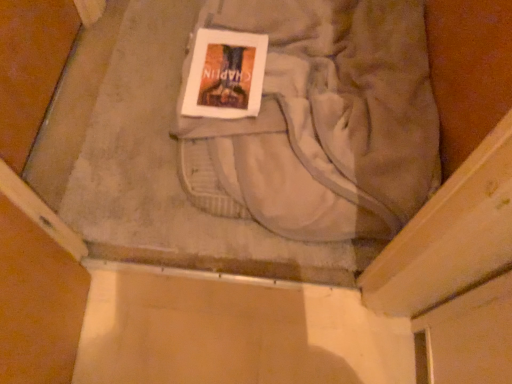
Image resolution: width=512 pixels, height=384 pixels. What do you see at coordinates (322, 122) in the screenshot?
I see `light gray cotton sweat pants at center` at bounding box center [322, 122].

The height and width of the screenshot is (384, 512). Find the location of `light gray cotton sweat pants at center`. light gray cotton sweat pants at center is located at coordinates (322, 122).

Measure the distance between point (361, 137) and camera.

1.15 meters.

Describe the element at coordinates (225, 74) in the screenshot. I see `hardcover book at center` at that location.

I want to click on hardcover book at center, so click(x=225, y=74).

What is the approximate height of hardcover book at center?

It is 1.00 centimeters.

Find the location of a particular element. The height and width of the screenshot is (384, 512). light gray cotton sweat pants at center is located at coordinates (322, 122).

Which is more to the right, hardcover book at center or light gray cotton sweat pants at center?

From the viewer's perspective, light gray cotton sweat pants at center appears more on the right side.

Is the depth of hardcover book at center less than that of light gray cotton sweat pants at center?

No.

Is point (234, 42) closer or farther from the camera than point (386, 223)?

Point (234, 42) appears to be farther away from the viewer than point (386, 223).

From the image's perspective, which is above, hardcover book at center or light gray cotton sweat pants at center?

light gray cotton sweat pants at center is shown above in the image.

From a real-world perspective, between hardcover book at center and light gray cotton sweat pants at center, who is vertically lower?

light gray cotton sweat pants at center.

Is hardcover book at center thinner than light gray cotton sweat pants at center?

Yes, hardcover book at center is thinner than light gray cotton sweat pants at center.

Considering the relative sizes of hardcover book at center and light gray cotton sweat pants at center in the image provided, is hardcover book at center taller than light gray cotton sweat pants at center?

No, hardcover book at center is not taller than light gray cotton sweat pants at center.

Considering the relative sizes of hardcover book at center and light gray cotton sweat pants at center in the image provided, is hardcover book at center smaller than light gray cotton sweat pants at center?

Yes.

Is hardcover book at center inside the boundaries of light gray cotton sweat pants at center, or outside?

hardcover book at center can be found inside light gray cotton sweat pants at center.

Is there a large distance between hardcover book at center and light gray cotton sweat pants at center?

They are positioned close to each other.

Could you tell me if hardcover book at center is facing light gray cotton sweat pants at center?

Yes, hardcover book at center faces towards light gray cotton sweat pants at center.

What's the angular difference between hardcover book at center and light gray cotton sweat pants at center's facing directions?

They differ by 0.415 degrees in their facing directions.

The image size is (512, 384). I want to click on sweat pant above the hardcover book at center (from the image's perspective), so click(322, 122).

Visually, is light gray cotton sweat pants at center positioned to the left or to the right of hardcover book at center?

Based on their positions, light gray cotton sweat pants at center is located to the right of hardcover book at center.

Who is more distant, light gray cotton sweat pants at center or hardcover book at center?

hardcover book at center is behind.

Which is closer to the camera, (x=323, y=6) or (x=208, y=50)?

Point (x=208, y=50)

From the image's perspective, is light gray cotton sweat pants at center on top of hardcover book at center?

Indeed, from the image's perspective, light gray cotton sweat pants at center is shown above hardcover book at center.

From a real-world perspective, which object stands above the other?

In real-world perspective, hardcover book at center is above.

Considering the relative sizes of light gray cotton sweat pants at center and hardcover book at center in the image provided, is light gray cotton sweat pants at center wider than hardcover book at center?

Yes, light gray cotton sweat pants at center is wider than hardcover book at center.

Who is taller, light gray cotton sweat pants at center or hardcover book at center?

light gray cotton sweat pants at center.

Which of these two, light gray cotton sweat pants at center or hardcover book at center, is smaller?

hardcover book at center is smaller.

Is hardcover book at center inside light gray cotton sweat pants at center?

Yes, light gray cotton sweat pants at center is surrounding hardcover book at center.

Is light gray cotton sweat pants at center beside hardcover book at center?

No, light gray cotton sweat pants at center is not beside hardcover book at center.

Looking at this image, is light gray cotton sweat pants at center looking in the opposite direction of hardcover book at center?

Yes, light gray cotton sweat pants at center is positioned with its back facing hardcover book at center.

Can you tell me how much light gray cotton sweat pants at center and hardcover book at center differ in facing direction?

The facing directions of light gray cotton sweat pants at center and hardcover book at center are 0.415 degrees apart.

This screenshot has height=384, width=512. I want to click on sweat pant located underneath the hardcover book at center (from a real-world perspective), so click(322, 122).

The height and width of the screenshot is (384, 512). In order to click on paperback book below the light gray cotton sweat pants at center (from the image's perspective) in this screenshot , I will do `click(225, 74)`.

The image size is (512, 384). I want to click on sweat pant lying on the right of hardcover book at center, so click(322, 122).